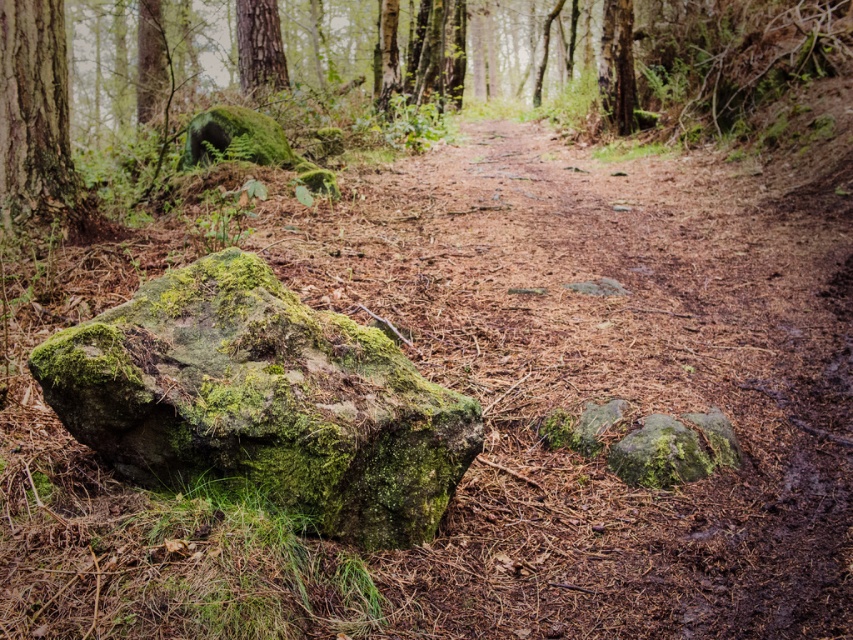
Which is in front, point (339, 404) or point (259, 88)?

Point (339, 404) is in front.

The image size is (853, 640). In order to click on green mossy rock at left in this screenshot , I will do `click(262, 401)`.

This screenshot has height=640, width=853. Find the location of `green mossy rock at left`. green mossy rock at left is located at coordinates (262, 401).

I want to click on smooth bark tree trunk at left, so click(38, 124).

Is point (10, 154) positioned in front of point (265, 35)?

Yes, point (10, 154) is closer to viewer.

Identify the location of smooth bark tree trunk at left. Image resolution: width=853 pixels, height=640 pixels. (38, 124).

From the picture: Can you confirm if green mossy rock at left is wider than smooth bark tree trunk at left?

Yes.

Is green mossy rock at left below smooth bark tree trunk at left?

Yes, green mossy rock at left is below smooth bark tree trunk at left.

Does point (343, 396) come farther from viewer compared to point (44, 221)?

No, (343, 396) is closer to viewer.

Locate an element on the screen. The width and height of the screenshot is (853, 640). green mossy rock at left is located at coordinates (262, 401).